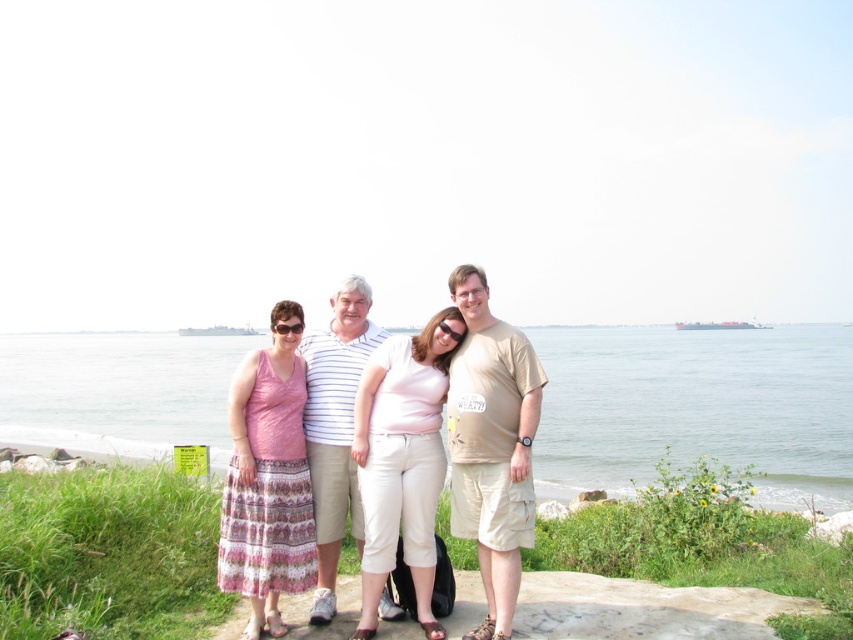
Looking at this image, you are a photographer trying to capture a group photo of the pink printed dress at left and the matte pink shirt at center. The camera you are using has a minimum focus distance of 30 inches. Will you be able to focus on both subjects clearly?

The pink printed dress at left and matte pink shirt at center are 28.87 inches apart, which is less than the camera minimum focus distance of 30 inches. Therefore, the camera may not be able to focus on both subjects clearly.